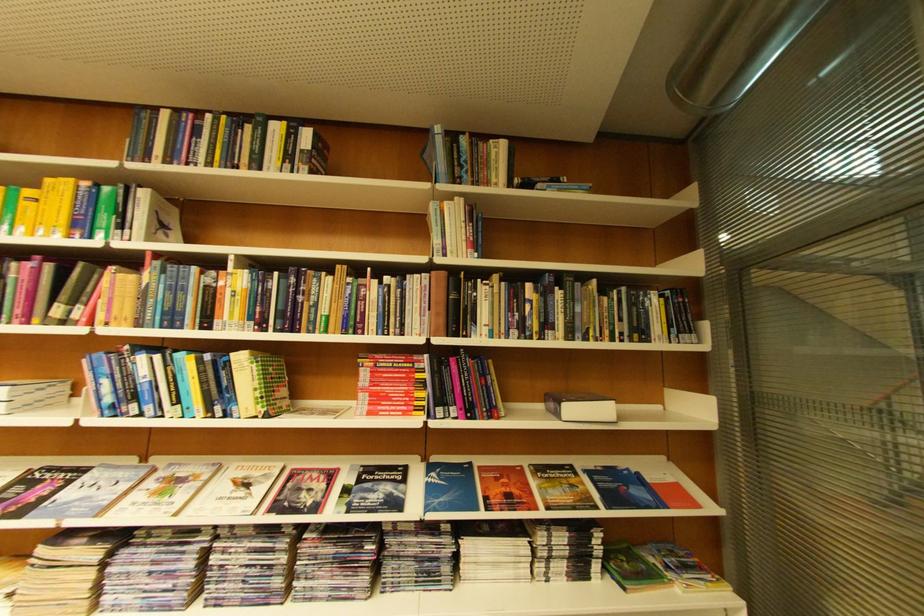
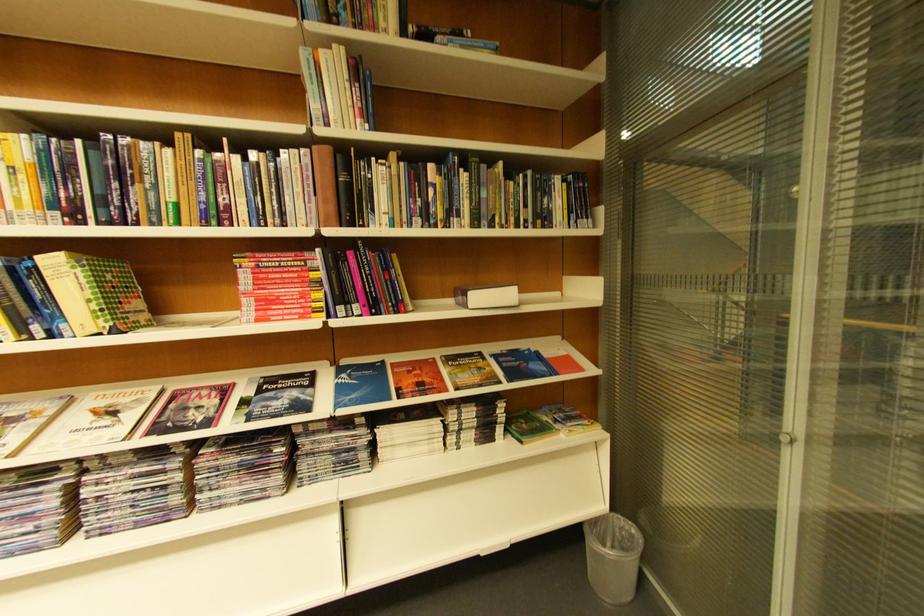
Find the pixel in the second image that matches point 497,185 in the first image.

(384, 31)